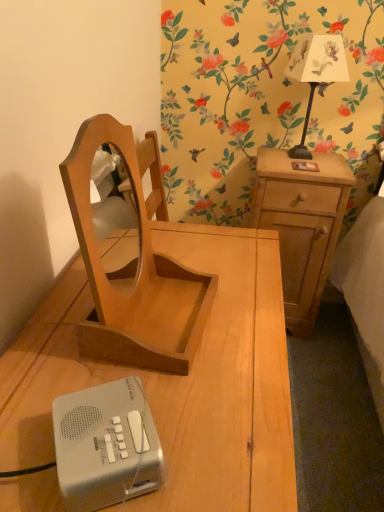
This screenshot has width=384, height=512. Find the location of `free spot below white paper lampshade at upper right (from a real-world perspective)`. free spot below white paper lampshade at upper right (from a real-world perspective) is located at coordinates (293, 160).